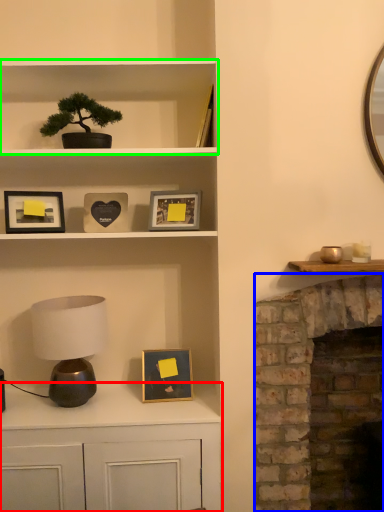
Question: Considering the real-world distances, which object is farthest from cabinetry (highlighted by a red box)? fireplace (highlighted by a blue box) or shelf (highlighted by a green box)?

Choices:
 (A) fireplace
 (B) shelf

Answer: (B)